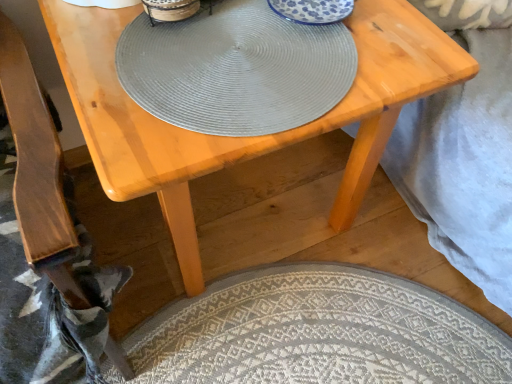
Identify the location of free space above neutral woven mat at lower center (from a real-world perspective). (330, 321).